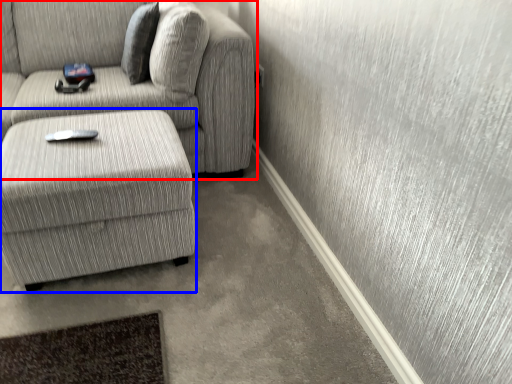
Question: Which object appears farthest to the camera in this image, studio couch (highlighted by a red box) or table (highlighted by a blue box)?

Choices:
 (A) studio couch
 (B) table

Answer: (A)